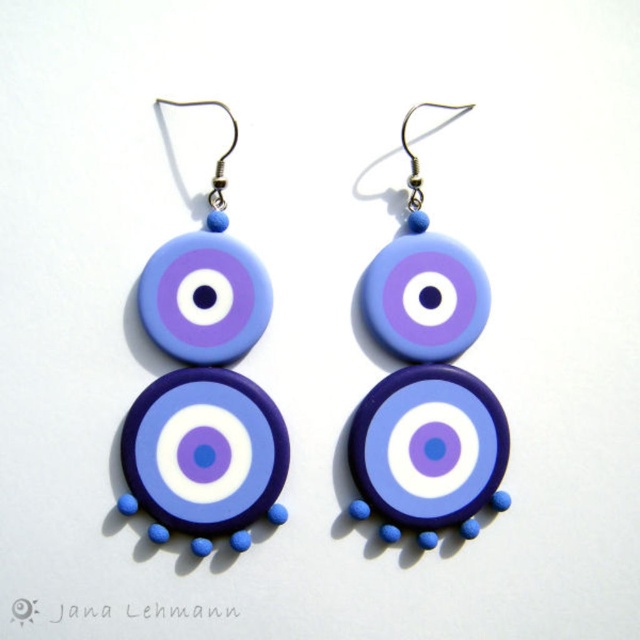
Can you confirm if matte clay eye at center is wider than matte clay earring at center?

Indeed, matte clay eye at center has a greater width compared to matte clay earring at center.

Does matte clay eye at center have a larger size compared to matte clay earring at center?

Yes, matte clay eye at center is bigger than matte clay earring at center.

Where is `matte clay eye at center`? matte clay eye at center is located at coordinates tap(205, 381).